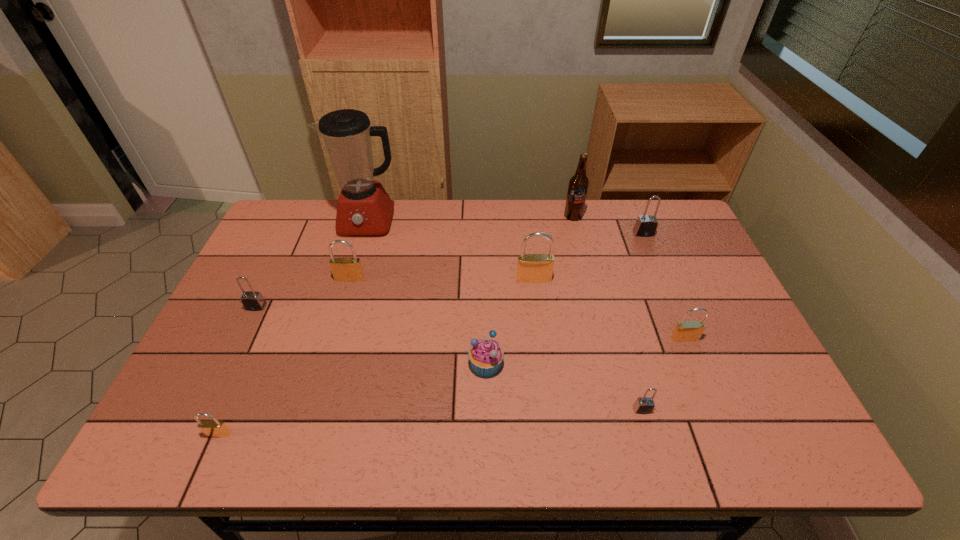
Find the location of `free point located 0.180m on the front-facing side of the tallest padlock`. free point located 0.180m on the front-facing side of the tallest padlock is located at coordinates (540, 331).

This screenshot has height=540, width=960. I want to click on vacant area situated 0.200m on the shackle of the biggest gray padlock, so click(x=663, y=280).

This screenshot has width=960, height=540. Find the location of `free spot located on the front-facing side of the third brass padlock from right to left`. free spot located on the front-facing side of the third brass padlock from right to left is located at coordinates (324, 363).

The height and width of the screenshot is (540, 960). Identify the location of free region located 0.280m on the shackle of the fifth nearest object. (211, 402).

This screenshot has width=960, height=540. Identify the location of vacant point located 0.240m on the front-facing side of the seventh farthest object. (721, 428).

Locate an element on the screen. vacant space located on the left of the fifth object from left to right is located at coordinates (369, 364).

Where is `vacant space located 0.080m on the shackle of the third padlock from right to left`? The image size is (960, 540). vacant space located 0.080m on the shackle of the third padlock from right to left is located at coordinates (654, 449).

The image size is (960, 540). In order to click on blender that is at the far edge in this screenshot , I will do `click(364, 208)`.

Find the location of a particular element. beer bottle present at the far edge is located at coordinates (578, 185).

The height and width of the screenshot is (540, 960). What are the coordinates of `padlock present at the far edge` in the screenshot? It's located at (646, 225).